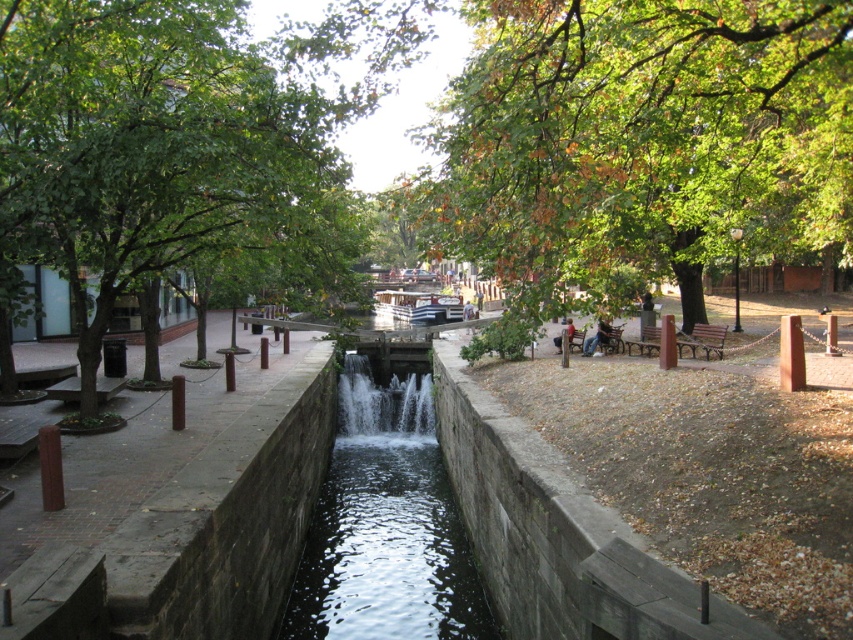
The width and height of the screenshot is (853, 640). What do you see at coordinates (171, 145) in the screenshot?
I see `green leafy tree at left` at bounding box center [171, 145].

In the scene shown: Is green leafy tree at left positioned behind leather jacket at center?

No, green leafy tree at left is in front of leather jacket at center.

Identify the location of green leafy tree at left. (171, 145).

Is clear water at center to the left of leather jacket at center from the viewer's perspective?

Yes, clear water at center is to the left of leather jacket at center.

Measure the distance between clear water at center and camera.

A distance of 10.46 meters exists between clear water at center and camera.

Is point (410, 388) positioned behind point (582, 355)?

That is True.

Locate an element on the screen. The width and height of the screenshot is (853, 640). clear water at center is located at coordinates (386, 525).

Is clear water at center bigger than dark blue jeans at center?

Yes, clear water at center is bigger than dark blue jeans at center.

The image size is (853, 640). In order to click on clear water at center in this screenshot , I will do `click(386, 525)`.

At what (x,y) coordinates should I click in order to perform the action: click on clear water at center. Please return your answer as a coordinate pair (x, y). The height and width of the screenshot is (640, 853). Looking at the image, I should click on (386, 525).